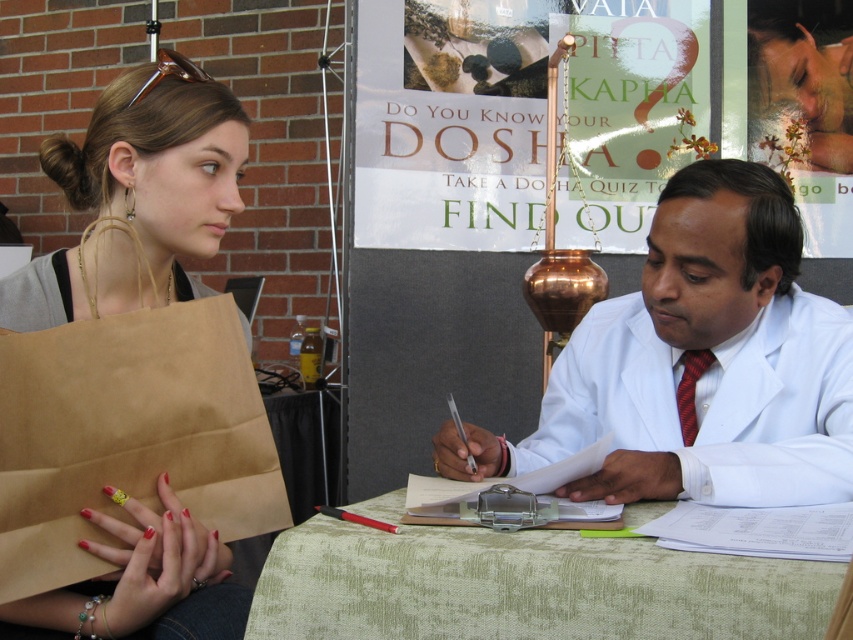
Question: Which of the following is the closest to the observer?

Choices:
 (A) white paperboard at center
 (B) red silk tie at right
 (C) brown paper bag at left

Answer: (C)

Question: Considering the relative positions of white paperboard at center and green fabric table at center in the image provided, where is white paperboard at center located with respect to green fabric table at center?

Choices:
 (A) left
 (B) right

Answer: (A)

Question: Where is white lab coat at center located in relation to brown paper bag at left in the image?

Choices:
 (A) left
 (B) right

Answer: (B)

Question: Does white lab coat at center have a lesser width compared to red silk tie at right?

Choices:
 (A) no
 (B) yes

Answer: (A)

Question: Which object is the farthest from the green fabric table at center?

Choices:
 (A) red silk tie at right
 (B) white paperboard at center
 (C) brown paper bag at left
 (D) white lab coat at center

Answer: (B)

Question: Which point is closer to the camera?

Choices:
 (A) (233, 125)
 (B) (634, 184)
 (C) (746, 349)
 (D) (558, 620)

Answer: (D)